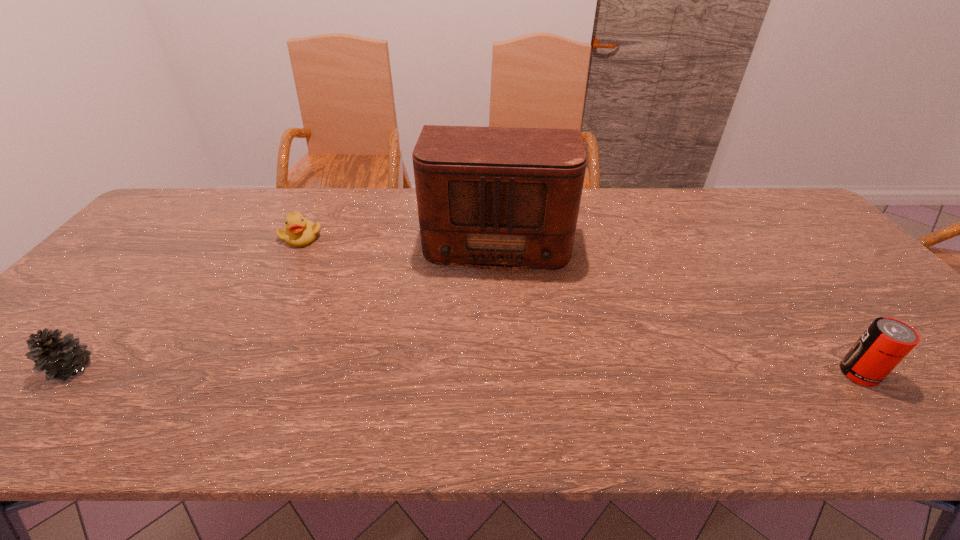
I want to click on free space on the desktop that is between the third tallest object and the third shortest object and is positioned on the front panel of the tallest object, so click(x=488, y=371).

Where is `vacant space on the desktop that is between the pinecone and the rightmost object and is positioned on the front-facing side of the shortest object`? vacant space on the desktop that is between the pinecone and the rightmost object and is positioned on the front-facing side of the shortest object is located at coordinates (424, 370).